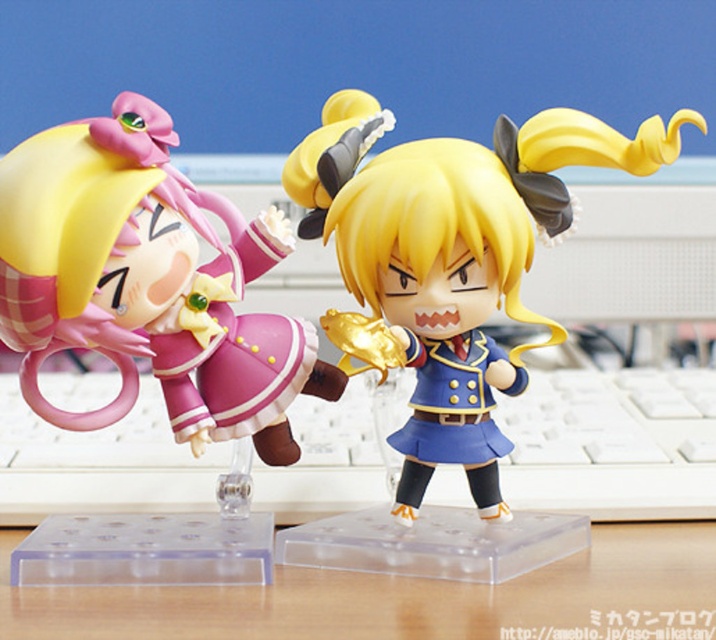
Question: Which object is farther from the camera taking this photo?

Choices:
 (A) blue glossy figure at center
 (B) wooden table at center

Answer: (A)

Question: Estimate the real-world distances between objects in this image. Which object is farther from the white plastic keyboard at center?

Choices:
 (A) matte pink plastic toy at left
 (B) blue glossy figure at center
 (C) wooden table at center

Answer: (A)

Question: Which object is the farthest from the wooden table at center?

Choices:
 (A) white plastic keyboard at center
 (B) blue glossy figure at center

Answer: (B)

Question: In this image, where is matte pink plastic toy at left located relative to white plastic keyboard at center?

Choices:
 (A) below
 (B) above

Answer: (B)

Question: Does matte pink plastic toy at left appear on the left side of blue glossy figure at center?

Choices:
 (A) no
 (B) yes

Answer: (B)

Question: Does white plastic keyboard at center have a larger size compared to wooden table at center?

Choices:
 (A) yes
 (B) no

Answer: (A)